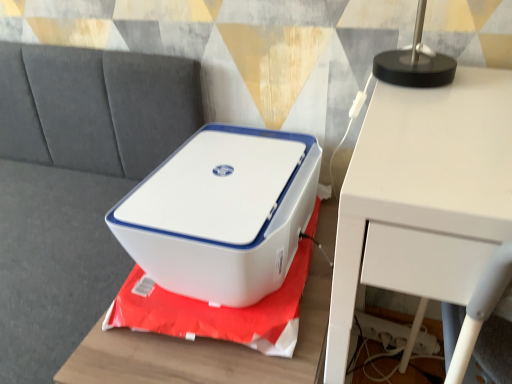
This screenshot has width=512, height=384. What do you see at coordinates (222, 213) in the screenshot?
I see `white plastic printer at center` at bounding box center [222, 213].

Image resolution: width=512 pixels, height=384 pixels. What do you see at coordinates (205, 351) in the screenshot?
I see `white plastic printer at center` at bounding box center [205, 351].

Locate an element on the screen. This screenshot has width=512, height=384. white matte table at upper right is located at coordinates (426, 205).

Between point (186, 193) and point (28, 144), which one is positioned in front?

The point (186, 193) is more forward.

Is white plastic printer at center wider than gray fabric couch at upper left?

No.

Where is `couch located below the white plastic printer at center (from the image's perspective)`? couch located below the white plastic printer at center (from the image's perspective) is located at coordinates (75, 185).

Is white plastic printer at center spatially inside gray fabric couch at upper left, or outside of it?

white plastic printer at center exists outside the volume of gray fabric couch at upper left.

From the image's perspective, which is below, white plastic printer at center or white plastic printer at center?

white plastic printer at center appears lower in the image.

Is white plastic printer at center not near white plastic printer at center?

Actually, white plastic printer at center and white plastic printer at center are a little close together.

Is white plastic printer at center to the right of white plastic printer at center from the viewer's perspective?

Yes, white plastic printer at center is to the right of white plastic printer at center.

Can you tell me how much white plastic printer at center and white plastic printer at center differ in facing direction?

The angular difference between white plastic printer at center and white plastic printer at center is 93.6 degrees.

Which of these two, gray fabric couch at upper left or white plastic printer at center, is bigger?

With larger size is gray fabric couch at upper left.

Between gray fabric couch at upper left and white plastic printer at center, which one appears on the left side from the viewer's perspective?

Positioned to the left is gray fabric couch at upper left.

The image size is (512, 384). What are the coordinates of `furniture behind the gray fabric couch at upper left` in the screenshot? It's located at (205, 351).

How far apart are white plastic printer at center and gray fabric couch at upper left?

A distance of 17.15 inches exists between white plastic printer at center and gray fabric couch at upper left.

Is white plastic printer at center not near gray fabric couch at upper left?

That's not correct — white plastic printer at center is a little close to gray fabric couch at upper left.

Is point (150, 353) positioned after point (34, 302)?

No, (150, 353) is closer to viewer.

Is white plastic printer at center outside of gray fabric couch at upper left?

white plastic printer at center is positioned outside gray fabric couch at upper left.

The height and width of the screenshot is (384, 512). In order to click on table on the right of the gray fabric couch at upper left in this screenshot , I will do `click(426, 205)`.

Visually, is white matte table at upper right positioned to the left or to the right of gray fabric couch at upper left?

white matte table at upper right is to the right of gray fabric couch at upper left.

From the image's perspective, is white matte table at upper right under gray fabric couch at upper left?

Yes.

Is white matte table at upper right completely or partially outside of gray fabric couch at upper left?

white matte table at upper right lies outside gray fabric couch at upper left's area.

Relative to white plastic printer at center, is white matte table at upper right in front or behind?

white matte table at upper right is positioned closer to the viewer than white plastic printer at center.

Is white matte table at upper right facing towards white plastic printer at center?

No, white matte table at upper right does not turn towards white plastic printer at center.

Is point (488, 97) farther from camera compared to point (164, 373)?

Yes, it is behind point (164, 373).

From the image's perspective, which one is positioned higher, white plastic printer at center or white plastic printer at center?

white plastic printer at center, from the image's perspective.

Is white plastic printer at center located within white plastic printer at center?

Actually, white plastic printer at center is outside white plastic printer at center.

Image resolution: width=512 pixels, height=384 pixels. Find the location of `furniture that is on the right side of white plastic printer at center`. furniture that is on the right side of white plastic printer at center is located at coordinates (205, 351).

Considering the relative sizes of white plastic printer at center and white plastic printer at center in the image provided, is white plastic printer at center bigger than white plastic printer at center?

Actually, white plastic printer at center might be smaller than white plastic printer at center.

I want to click on storage box behind the gray fabric couch at upper left, so click(222, 213).

This screenshot has height=384, width=512. Identify the location of furniture that appears in front of the white plastic printer at center. (205, 351).

Based on their spatial positions, is gray fabric couch at upper left or white matte table at upper right further from white plastic printer at center?

gray fabric couch at upper left.

Considering their positions, is white plastic printer at center positioned further to white matte table at upper right than gray fabric couch at upper left?

The object further to white matte table at upper right is gray fabric couch at upper left.

Considering their positions, is white plastic printer at center positioned closer to gray fabric couch at upper left than white matte table at upper right?

white plastic printer at center.

Considering their positions, is white plastic printer at center positioned further to white plastic printer at center than white matte table at upper right?

white matte table at upper right lies further to white plastic printer at center than the other object.

When comparing their distances from white plastic printer at center, does white matte table at upper right or gray fabric couch at upper left seem further?

Among the two, gray fabric couch at upper left is located further to white plastic printer at center.

Estimate the real-world distances between objects in this image. Which object is further from white plastic printer at center, white plastic printer at center or gray fabric couch at upper left?

gray fabric couch at upper left.

Considering their positions, is white plastic printer at center positioned further to gray fabric couch at upper left than white plastic printer at center?

white plastic printer at center.

From the image, which object appears to be nearer to white plastic printer at center, gray fabric couch at upper left or white plastic printer at center?

Among the two, white plastic printer at center is located nearer to white plastic printer at center.

Where is `storage box situated between gray fabric couch at upper left and white matte table at upper right from left to right`? storage box situated between gray fabric couch at upper left and white matte table at upper right from left to right is located at coordinates (222, 213).

Where is `storage box situated between gray fabric couch at upper left and white plastic printer at center from left to right`? storage box situated between gray fabric couch at upper left and white plastic printer at center from left to right is located at coordinates (222, 213).

The image size is (512, 384). What are the coordinates of `furniture between gray fabric couch at upper left and white matte table at upper right` in the screenshot? It's located at (205, 351).

Where is `furniture located between white plastic printer at center and white matte table at upper right in the left-right direction`? furniture located between white plastic printer at center and white matte table at upper right in the left-right direction is located at coordinates (205, 351).